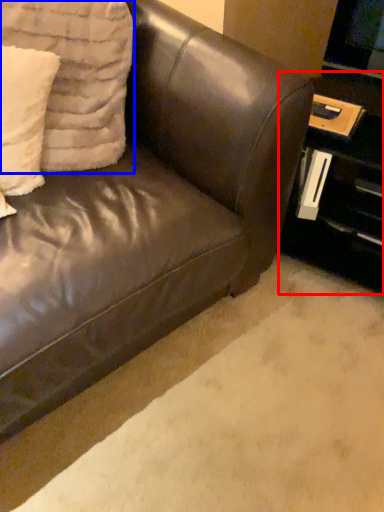
Question: Among these objects, which one is farthest to the camera, table (highlighted by a red box) or pillow (highlighted by a blue box)?

Choices:
 (A) table
 (B) pillow

Answer: (A)